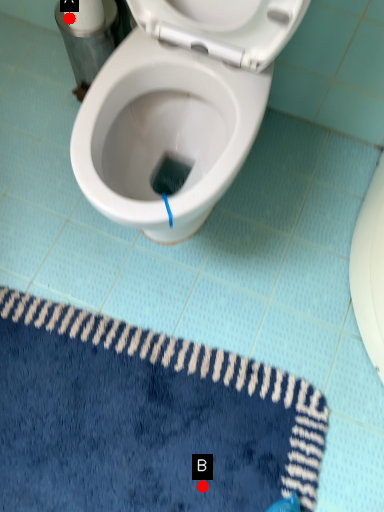
Question: Two points are circled on the image, labeled by A and B beside each circle. Among these points, which one is farthest from the camera?

Choices:
 (A) A is further
 (B) B is further

Answer: (A)